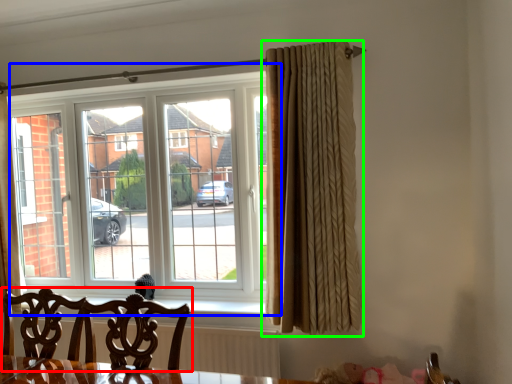
Question: Which is nearer to the chair (highlighted by a red box)? window (highlighted by a blue box) or curtain (highlighted by a green box).

Choices:
 (A) window
 (B) curtain

Answer: (B)